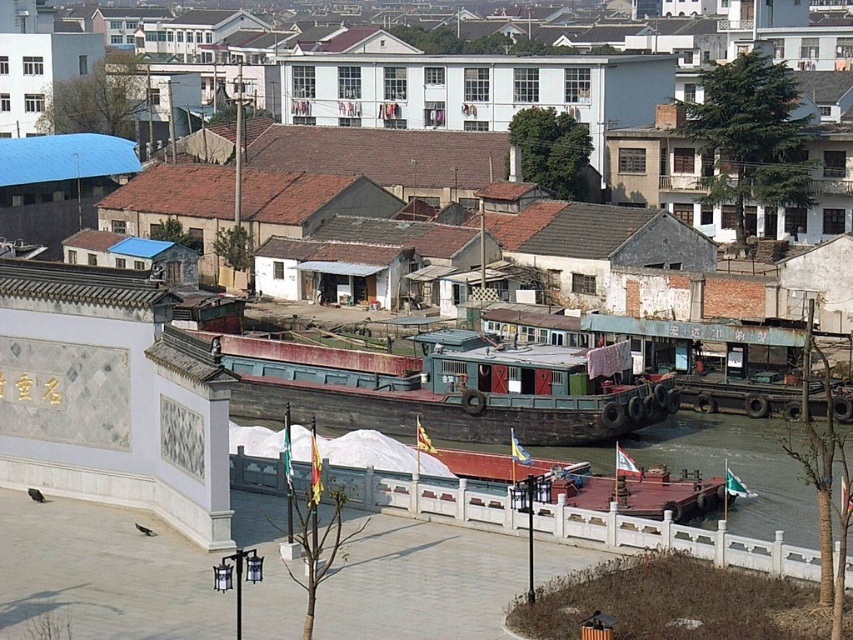
You are standing at the plaza near the wall with flags and want to take a photo of both the point at coordinates (491, 362) and the point at (770, 488). Which point will appear closer to the camera in your photo?

Point (491, 362) is closer to the camera because it is further to the viewer than point (770, 488), making it appear larger in the photo.

You are a photographer planning to capture the rusty wooden barge at center and the smooth brown water at lower right in a single frame. Considering their sizes, which object will occupy more space in your photo?

The rusty wooden barge at center will occupy more space in the photo since it has a larger size compared to the smooth brown water at lower right.

You are standing at the origin point of the coordinate system placed at the bottom left corner of the image. The rusty wooden barge at center is located at coordinates point. Can you tell me its exact coordinates?

The rusty wooden barge at center is located at coordinates point (445, 388).